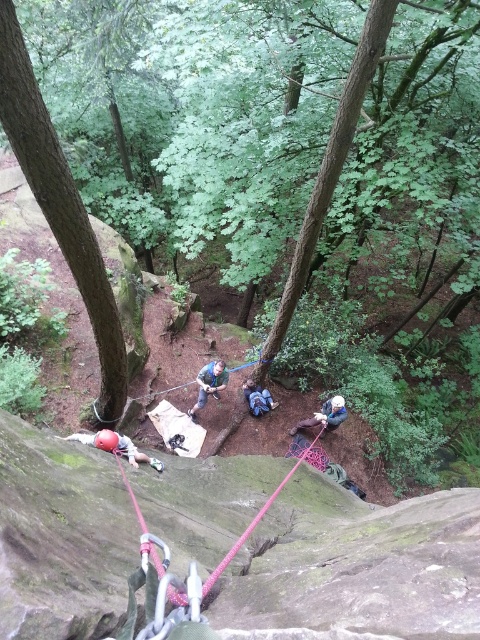
Between green rough bark tree at center and blue fabric at center, which one is positioned lower?

Positioned lower is blue fabric at center.

Find the location of a particular element. The image size is (480, 640). green rough bark tree at center is located at coordinates (199, 113).

Does brown rough tree trunk at left have a lesser height compared to matte red helmet at lower left?

In fact, brown rough tree trunk at left may be taller than matte red helmet at lower left.

Can you confirm if brown rough tree trunk at left is positioned to the left of matte red helmet at lower left?

Indeed, brown rough tree trunk at left is positioned on the left side of matte red helmet at lower left.

Is point (29, 172) farther from viewer compared to point (119, 449)?

No, (29, 172) is in front of (119, 449).

You are a GUI agent. You are given a task and a screenshot of the screen. Output one action in this format:
    pyautogui.click(x=<x>, y=<y>)
    Task: Click on the brown rough tree trunk at left
    The height and width of the screenshot is (640, 480).
    Given the screenshot: What is the action you would take?
    pos(60,208)

At what (x,y) coordinates should I click in order to perform the action: click on blue fabric shirt at center. Please return your answer as a coordinate pair (x, y). Looking at the image, I should click on (208, 384).

Can you confirm if blue fabric shirt at center is shorter than matte red helmet at lower left?

In fact, blue fabric shirt at center may be taller than matte red helmet at lower left.

The image size is (480, 640). I want to click on blue fabric shirt at center, so click(208, 384).